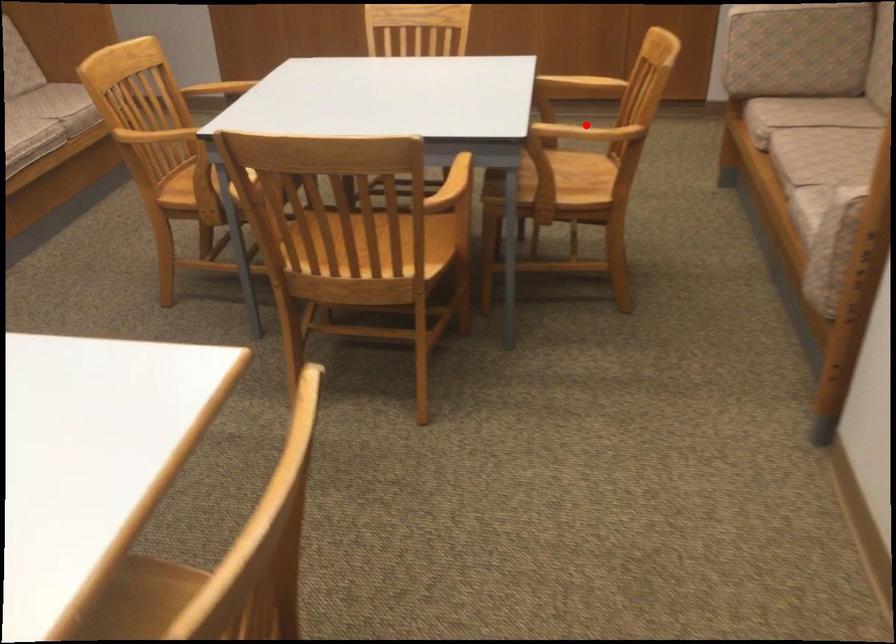
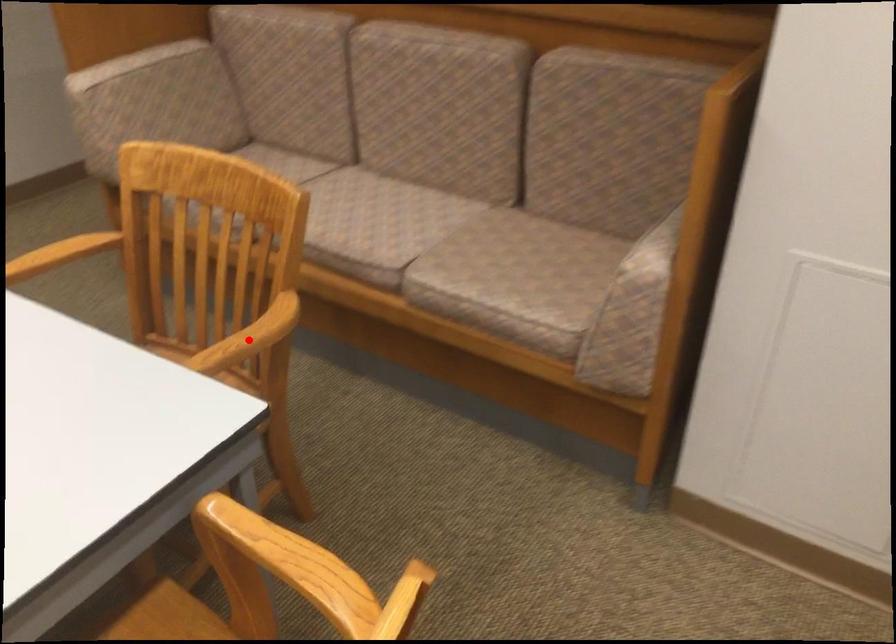
I am providing you with two images of the same scene from different viewpoints. A red point is marked on the first image and another point is marked on the second image. Does the point marked in image1 correspond to the same location as the one in image2?

Yes